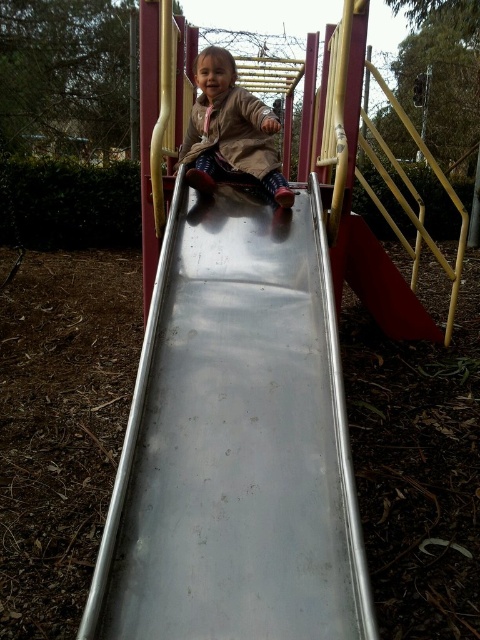
You are a parent standing at the camera position and want to ensure your child can safely reach the metallic smooth slide at center from where you are standing. Considering the distance between you and the slide, can you easily hand your child the water bottle you have without moving closer?

The distance between the metallic smooth slide at center and the camera is 4.28 feet. Since this distance is relatively short, you can easily hand the water bottle to your child without needing to move closer.

You are standing at the playground and see the point marked at coordinate (235, 444). What object is located at that point?

The point at coordinate (235, 444) corresponds to the metallic smooth slide at center.

You are a parent at the playground. You see your child wearing the matte brown coat at center sitting on the metallic smooth slide at center. You want to make sure the slide is safe for them to slide down. Considering the size of the slide and the coat, can the child safely slide down without getting stuck?

The metallic smooth slide at center is larger in size than the matte brown coat at center, so the child can safely slide down without getting stuck.